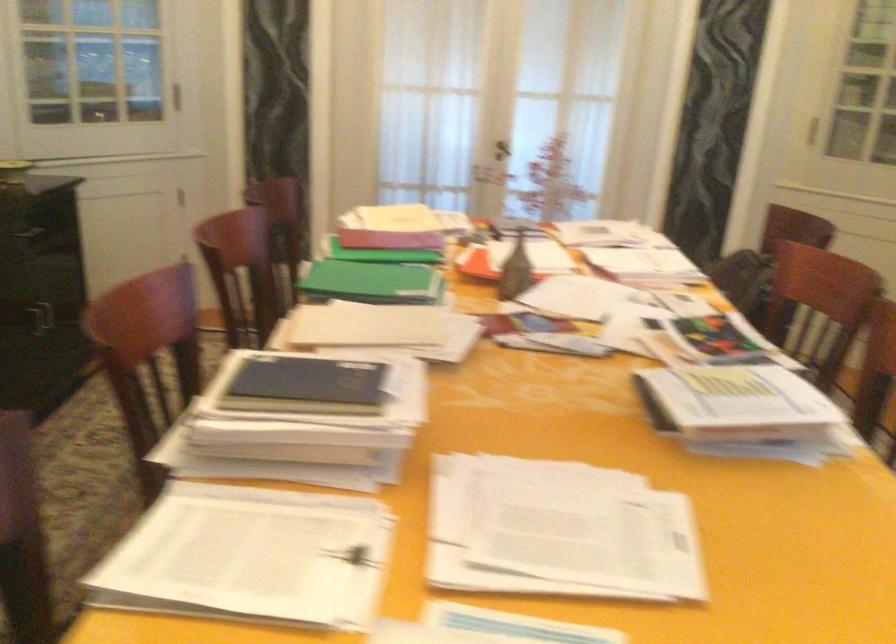
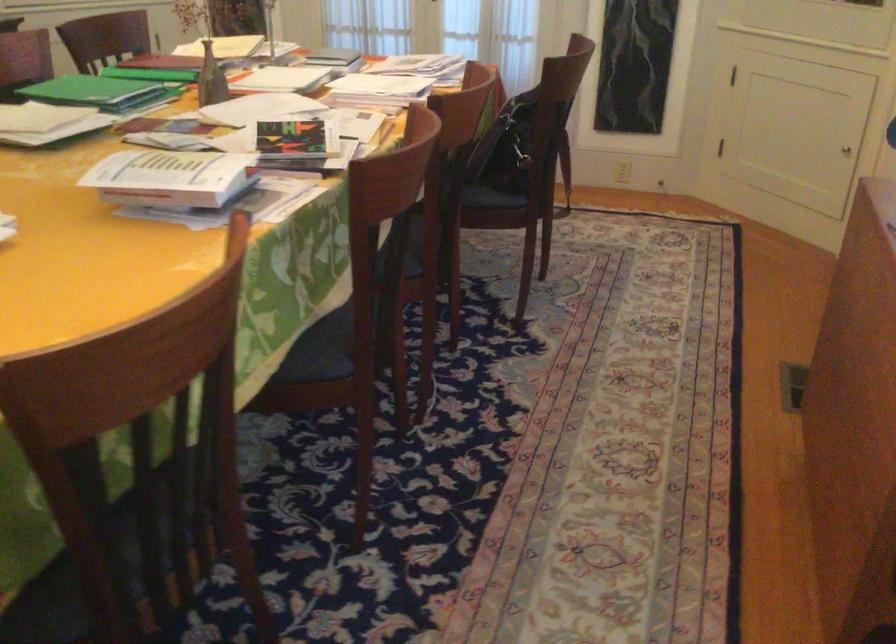
Question: What movement of the cameraman would produce the second image?

Choices:
 (A) Left
 (B) Right
 (C) Forward
 (D) Backward

Answer: (B)